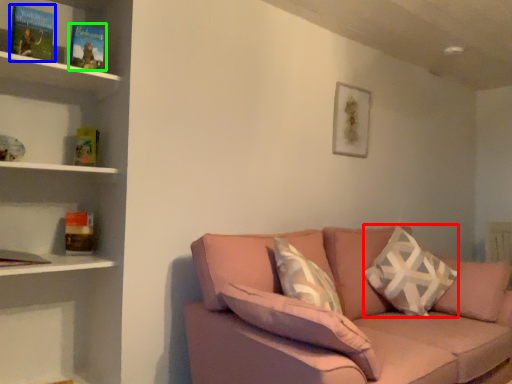
Question: Which object is the farthest from throw pillow (highlighted by a red box)? Choose among these: paperback book (highlighted by a blue box) or paperback book (highlighted by a green box).

Choices:
 (A) paperback book
 (B) paperback book

Answer: (A)